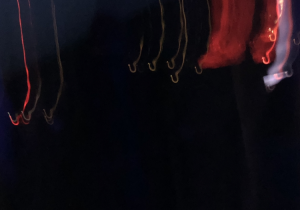
This screenshot has width=300, height=210. Find the location of `short gold hook in center`. short gold hook in center is located at coordinates (140, 51), (158, 51), (176, 55), (183, 60), (210, 30).